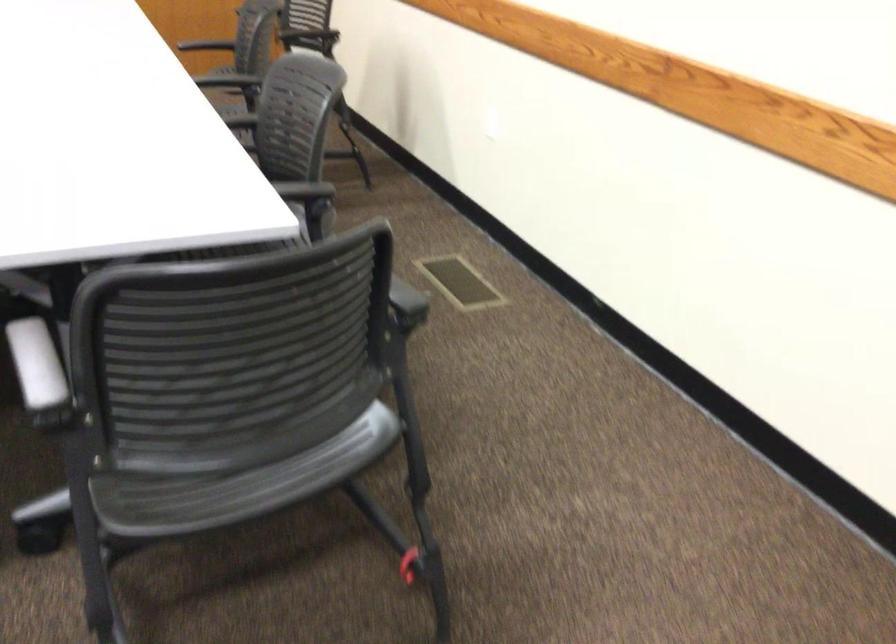
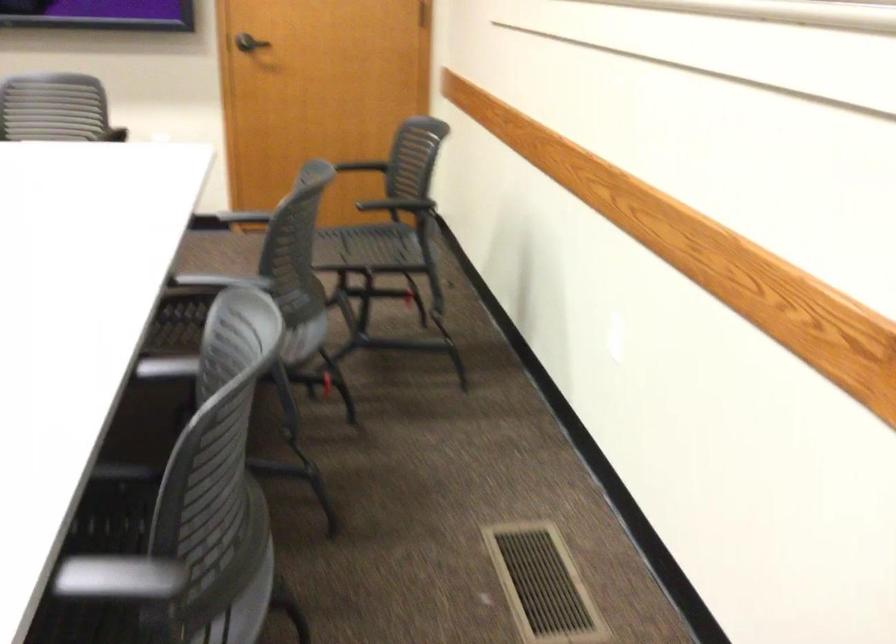
Locate, in the second image, the point that corresponds to [279,80] in the first image.

(225, 319)